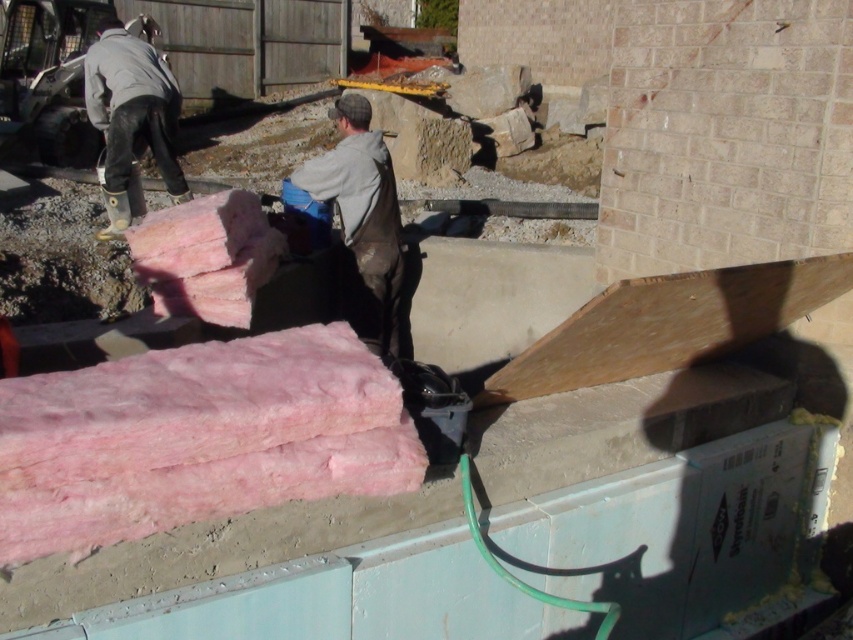
Is point (552, 497) farther from camera compared to point (135, 83)?

No.

Can you confirm if pink fiberglass insulation at lower left is bigger than gray matte jacket at upper left?

Yes.

Measure the distance between point (660, 490) and camera.

Point (660, 490) is 2.33 meters from camera.

Where is `pink fiberglass insulation at lower left`? Image resolution: width=853 pixels, height=640 pixels. pink fiberglass insulation at lower left is located at coordinates (666, 532).

Between pink fiberglass insulation at lower left and gray matte jacket at center, which one has less height?

Standing shorter between the two is pink fiberglass insulation at lower left.

At what (x,y) coordinates should I click in order to perform the action: click on pink fiberglass insulation at lower left. Please return your answer as a coordinate pair (x, y). This screenshot has width=853, height=640. Looking at the image, I should click on (666, 532).

This screenshot has width=853, height=640. What are the coordinates of `pink fiberglass insulation at lower left` in the screenshot? It's located at (666, 532).

Between gray matte jacket at center and gray matte jacket at upper left, which one has less height?

Standing shorter between the two is gray matte jacket at center.

Which is in front, point (378, 177) or point (112, 205)?

Positioned in front is point (378, 177).

At what (x,y) coordinates should I click in order to perform the action: click on gray matte jacket at center. Please return your answer as a coordinate pair (x, y). Looking at the image, I should click on (363, 218).